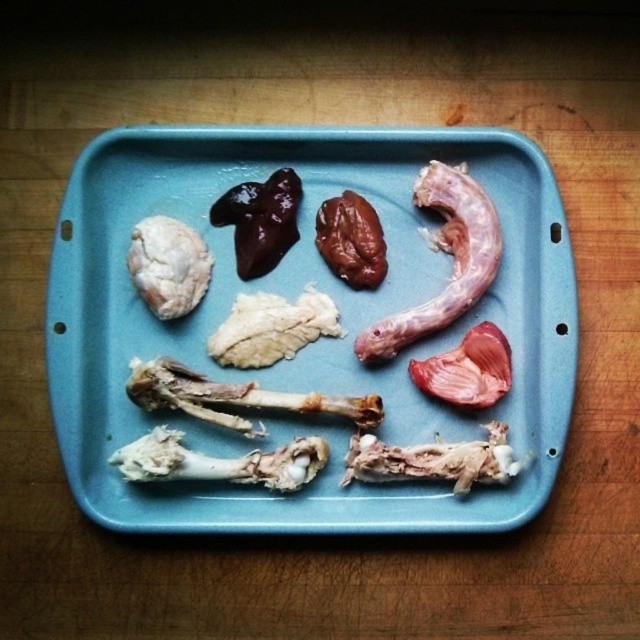
You are a chef preparing ingredients for a dish and see the blue plastic tray at center and the white bone at bottom left. Which object is located to the right of the other?

The blue plastic tray at center is positioned on the right side of white bone at bottom left, so the blue plastic tray at center is to the right of the white bone at bottom left.

You need to place a small toy that is the same size as the white bone at bottom left into the blue plastic tray at center. Based on the scene, will the toy fit inside the tray?

The blue plastic tray at center has a larger size compared to the white bone at bottom left, so the toy will fit inside the tray.

You are a chef preparing a dish and need to place the white soft heart at upper left and the pink soft tissue at center onto a rectangular blue tray. The tray has limited space. Can you determine if these two items can be placed on the tray without overlapping each other?

The white soft heart at upper left is 16.04 inches away from the pink soft tissue at center, so they can be placed on the tray without overlapping since the distance between them is sufficient.